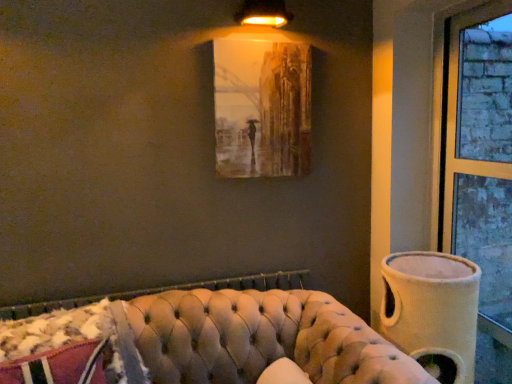
Locate an element on the screen. The image size is (512, 384). empty space that is ontop of beige fabric vase at right (from a real-world perspective) is located at coordinates (432, 262).